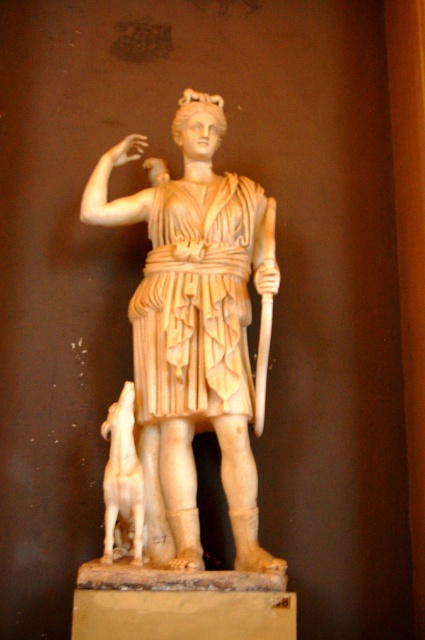
You are standing in front of the classical marble statue scene. There is a white marble statue at center and a matte beige dog at lower left. Which object is positioned to the right of the other?

The white marble statue at center is to the right of the matte beige dog at lower left.

You are an art conservator tasked with placing a protective barrier around the white marble statue at center. The barrier must be positioned at coordinates between 0.4 and 0.6 on both the x and y axes to ensure it fully encloses the statue. Based on the statue location at point 0.517, 0.454, will the barrier placement meet the required coordinates?

The white marble statue at center is located at point (192, 330). Since both coordinates fall within the range of 0.4 to 0.6 on both axes, the barrier placement will successfully enclose the statue.

You are an art conservator examining the statue. You notice two points of concern on the statue. One is at coordinate point [142,301] and the other at point [141,547]. From your vantage point, which of these points is closer to you?

Point [141,547] is closer to you because the description states that point [142,301] is behind point [141,547].